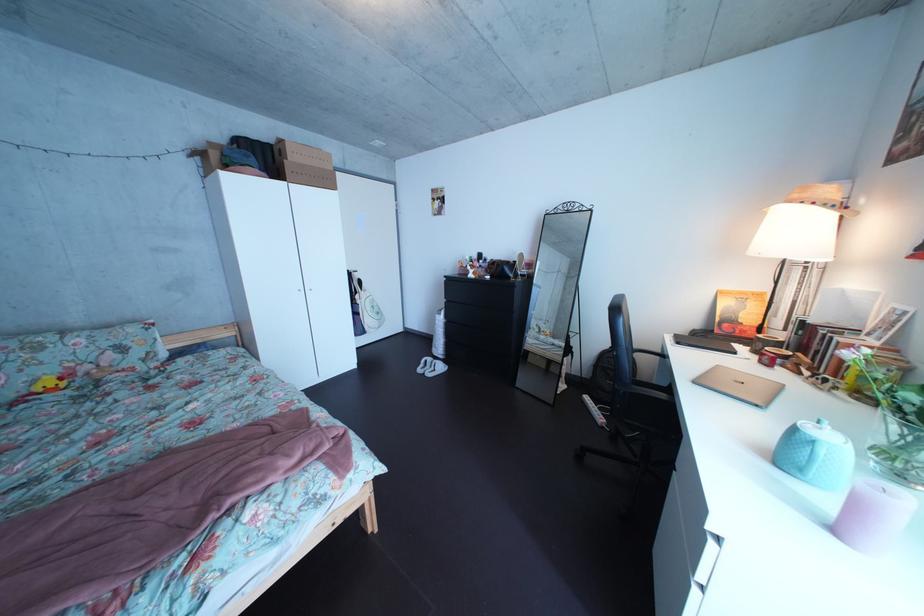
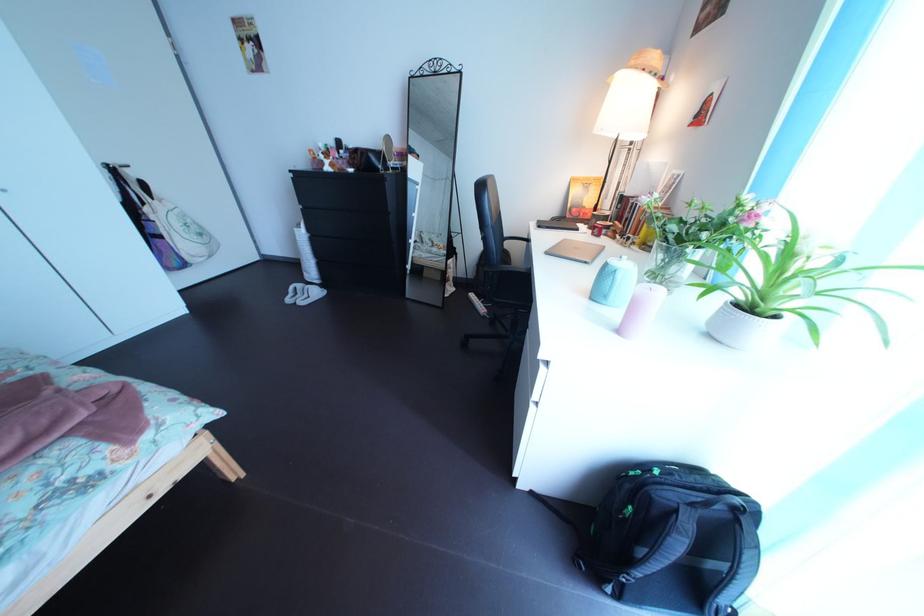
Locate, in the second image, the point that corresponds to [677,363] in the first image.

(541, 248)